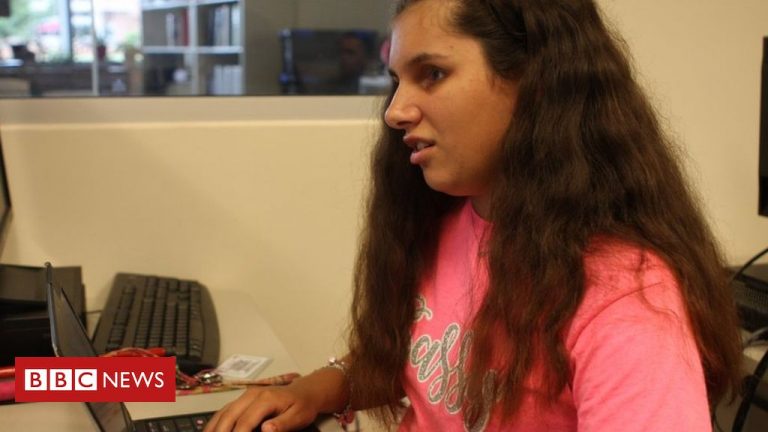
Locate an element on the screen. This screenshot has height=432, width=768. short white wall is located at coordinates (210, 182).